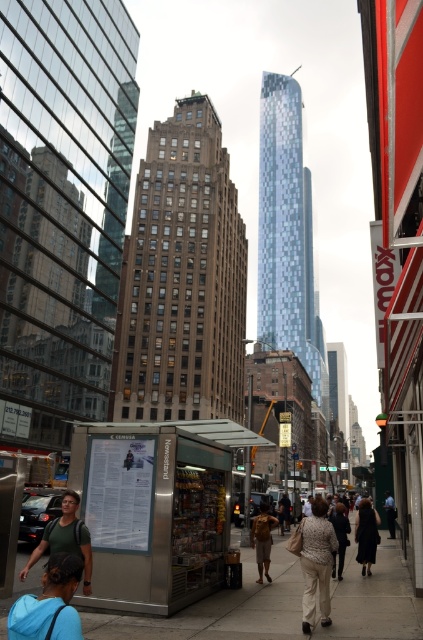
You are standing at the newsstand in the foreground of the urban street scene. You notice an object located at point [316,563]. What is the object at that point?

The object at point [316,563] is patterned fabric pants at center.

You are a delivery person who needs to pick up a package from the newsstand. You see a blue fabric backpack at lower left and a light beige fabric coat at center. Which item is positioned higher up from the ground?

The blue fabric backpack at lower left is located above the light beige fabric coat at center, so the backpack is higher up from the ground.